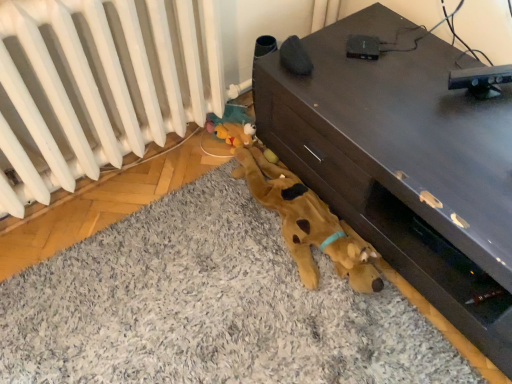
Question: In terms of size, does white matte radiator at lower left appear bigger or smaller than brown matte tv stand at lower right?

Choices:
 (A) small
 (B) big

Answer: (A)

Question: From the image's perspective, relative to brown matte tv stand at lower right, is white matte radiator at lower left above or below?

Choices:
 (A) below
 (B) above

Answer: (B)

Question: Which object is the farthest from the white matte radiator at lower left?

Choices:
 (A) soft gray carpet at lower center
 (B) brown matte tv stand at lower right

Answer: (B)

Question: Based on their relative distances, which object is nearer to the soft gray carpet at lower center?

Choices:
 (A) white matte radiator at lower left
 (B) brown matte tv stand at lower right

Answer: (B)